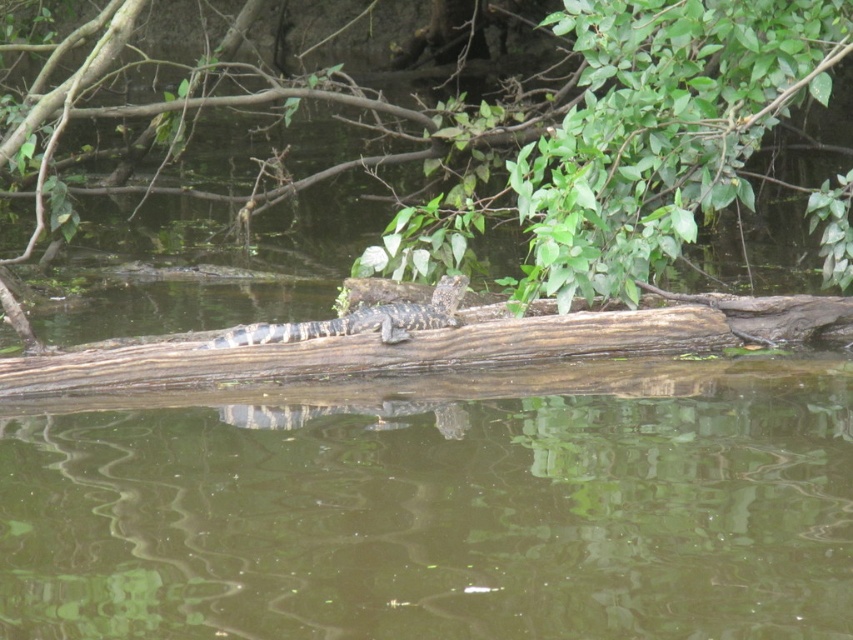
Question: Is brown wood log at center above green leafy tree at upper center?

Choices:
 (A) yes
 (B) no

Answer: (B)

Question: Does green leafy tree at upper center come behind brown textured log at center?

Choices:
 (A) yes
 (B) no

Answer: (A)

Question: Estimate the real-world distances between objects in this image. Which object is closer to the brown wood log at center?

Choices:
 (A) green leafy tree at upper center
 (B) brown textured log at center

Answer: (B)

Question: Among these objects, which one is farthest from the camera?

Choices:
 (A) brown textured log at center
 (B) green leafy tree at upper center
 (C) brown wood log at center

Answer: (B)

Question: Can you confirm if brown wood log at center is bigger than brown textured log at center?

Choices:
 (A) no
 (B) yes

Answer: (B)

Question: Which point is farther from the camera taking this photo?

Choices:
 (A) (392, 273)
 (B) (750, 492)

Answer: (A)